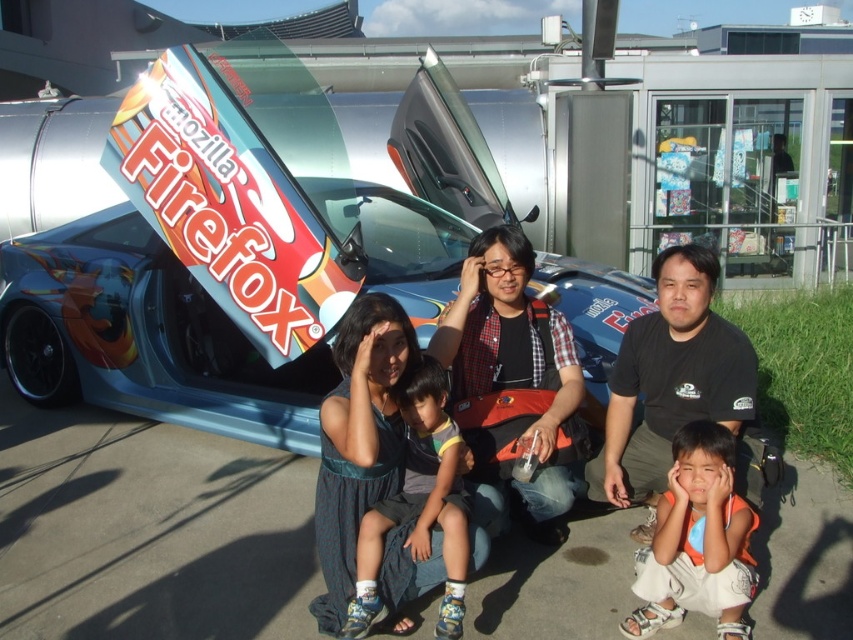
Question: Which point is farther to the camera?

Choices:
 (A) blue denim shorts at center
 (B) matte black life vest at center
 (C) orange t-shirt at lower right
 (D) matte blue car at center

Answer: (B)

Question: Considering the real-world distances, which object is farthest from the black cotton shirt at center?

Choices:
 (A) shiny metallic car at center
 (B) matte blue car at center
 (C) blue denim shorts at center

Answer: (A)

Question: Estimate the real-world distances between objects in this image. Which object is farther from the shiny metallic car at center?

Choices:
 (A) orange t-shirt at lower right
 (B) matte blue car at center
 (C) blue denim shorts at center

Answer: (C)

Question: Is matte black life vest at center below blue denim shorts at center?

Choices:
 (A) yes
 (B) no

Answer: (B)

Question: Is black cotton shirt at center thinner than matte black life vest at center?

Choices:
 (A) yes
 (B) no

Answer: (A)

Question: Considering the relative positions of matte blue car at center and blue denim shorts at center in the image provided, where is matte blue car at center located with respect to blue denim shorts at center?

Choices:
 (A) below
 (B) above

Answer: (B)